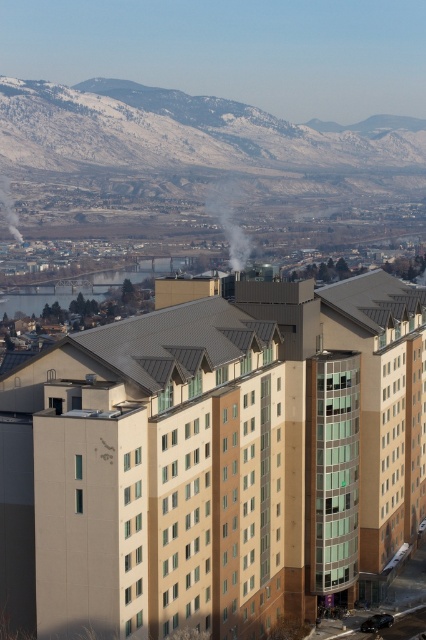
Question: Which point is closer to the camera?

Choices:
 (A) smokesmoky at left
 (B) white smoke at center

Answer: (B)

Question: Can you confirm if white smoke at center is wider than smokesmoky at left?

Choices:
 (A) yes
 (B) no

Answer: (A)

Question: Is white smoke at center to the left of smokesmoky at left from the viewer's perspective?

Choices:
 (A) no
 (B) yes

Answer: (A)

Question: Which of the following is the closest to the observer?

Choices:
 (A) (6, 209)
 (B) (238, 236)

Answer: (B)

Question: Which object appears closest to the camera in this image?

Choices:
 (A) white smoke at center
 (B) smokesmoky at left

Answer: (A)

Question: Is white smoke at center bigger than smokesmoky at left?

Choices:
 (A) yes
 (B) no

Answer: (A)